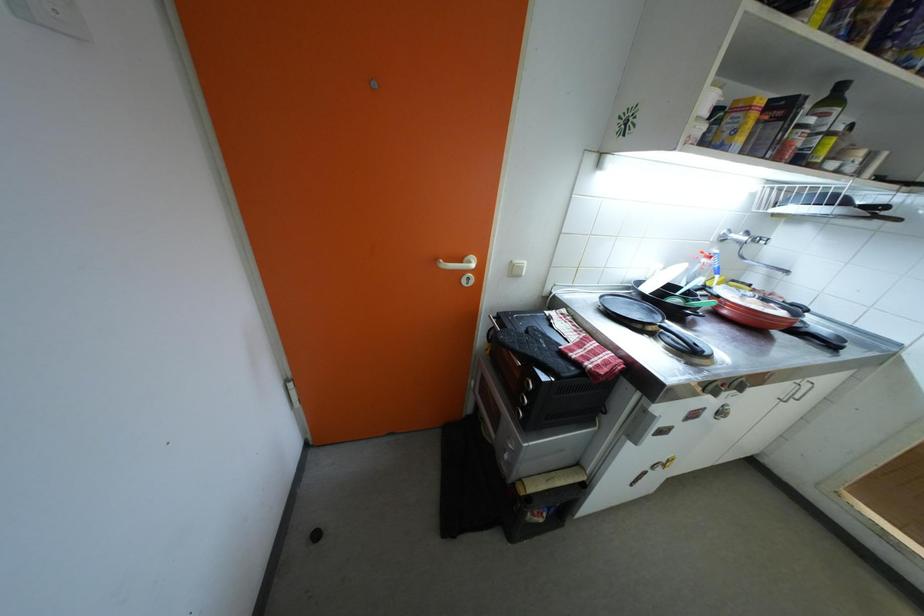
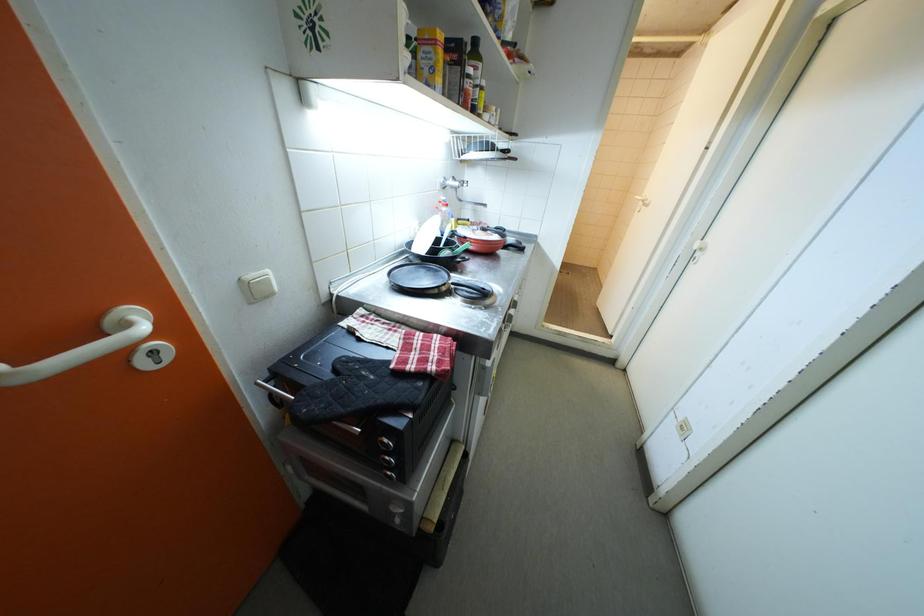
From the picture: The images are taken continuously from a first-person perspective. In which direction is your viewpoint rotating?

The camera rotated toward right-down.